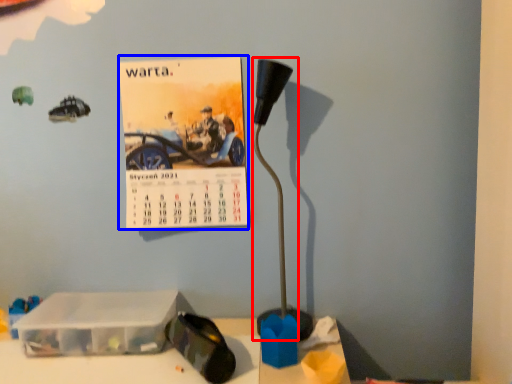
Question: Which object appears closest to the camera in this image, lamp (highlighted by a red box) or postcard (highlighted by a blue box)?

Choices:
 (A) lamp
 (B) postcard

Answer: (A)